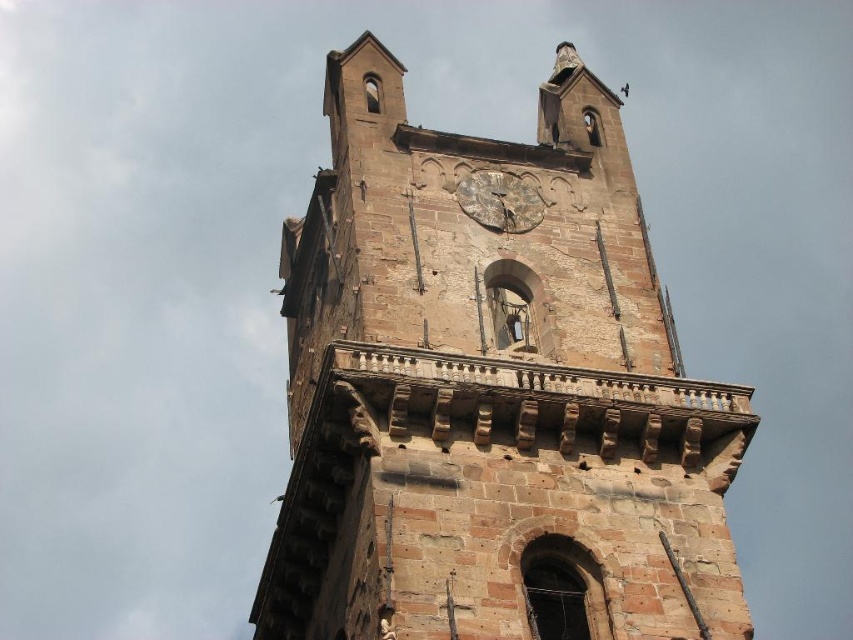
You are standing in front of the brown stone clock tower at center and the rusty metal clock at center. Which object is closer to you?

The brown stone clock tower at center is closer to you because it is in front of the rusty metal clock at center.

You are standing in front of the historic stone tower and want to take a photo of the point at coordinates point (523, 292). The camera you have can focus on objects up to 50 meters away. Will the point be in focus?

The distance of point (523, 292) from viewer is 47.89 meters, so yes, the point will be in focus since it is within the camera focus range of up to 50 meters.

You are standing in front of the historic stone tower and want to take a photo. You notice two points marked on the tower. Which of the two points, point [515,378] or point [465,208], is closer to you?

Point [515,378] is closer to the camera than point [465,208], so it is closer to you.